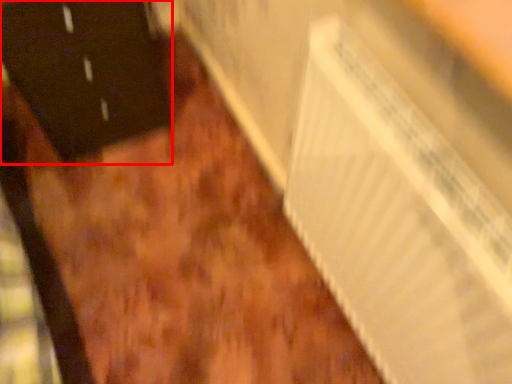
Question: From the image's perspective, where is door (annotated by the red box) located in relation to radiator in the image?

Choices:
 (A) above
 (B) below

Answer: (A)